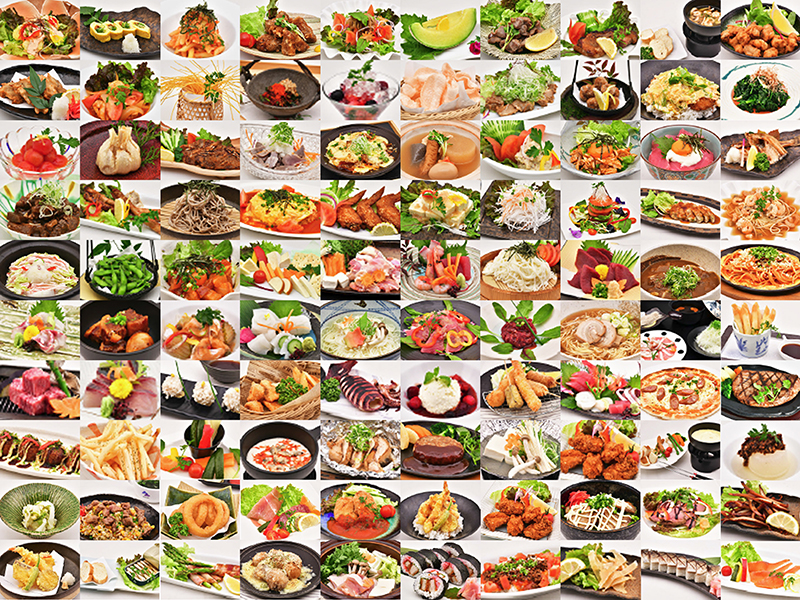
The width and height of the screenshot is (800, 600). Identify the location of photos in the corners. (742, 556), (46, 562), (48, 35), (756, 18).